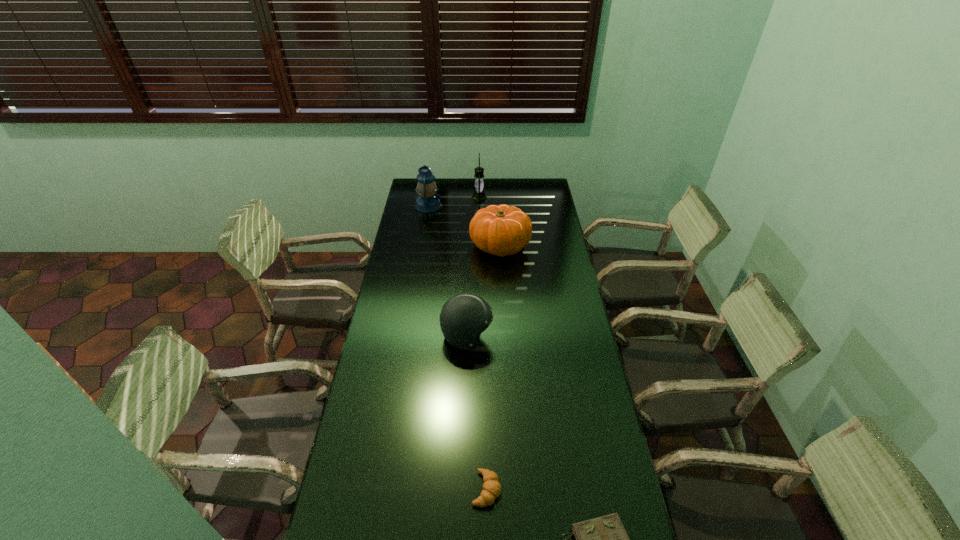
The height and width of the screenshot is (540, 960). I want to click on object positioned at the left edge, so click(428, 201).

Find the location of a particular element. object that is at the right edge is located at coordinates (502, 230).

Locate an element on the screen. The height and width of the screenshot is (540, 960). object present at the far left corner is located at coordinates (428, 201).

Where is `free location at the far edge of the desktop`? This screenshot has width=960, height=540. free location at the far edge of the desktop is located at coordinates tap(449, 179).

Image resolution: width=960 pixels, height=540 pixels. In order to click on vacant space at the left edge of the desktop in this screenshot , I will do `click(411, 347)`.

In order to click on vacant space at the right edge of the desktop in this screenshot , I will do `click(538, 205)`.

Where is `empty location between the leftmost object and the football helmet`? empty location between the leftmost object and the football helmet is located at coordinates (447, 271).

Find the location of a particular element. The width and height of the screenshot is (960, 540). free space between the leftmost object and the fourth farthest object is located at coordinates (447, 271).

You are a GUI agent. You are given a task and a screenshot of the screen. Output one action in this format:
    pyautogui.click(x=<x>, y=<y>)
    Task: Click on the vacant point located between the leftmost object and the right lantern
    
    Given the screenshot: What is the action you would take?
    pyautogui.click(x=454, y=201)

This screenshot has width=960, height=540. What are the coordinates of `vacant area that lies between the leftmost object and the third farthest object` in the screenshot? It's located at (465, 226).